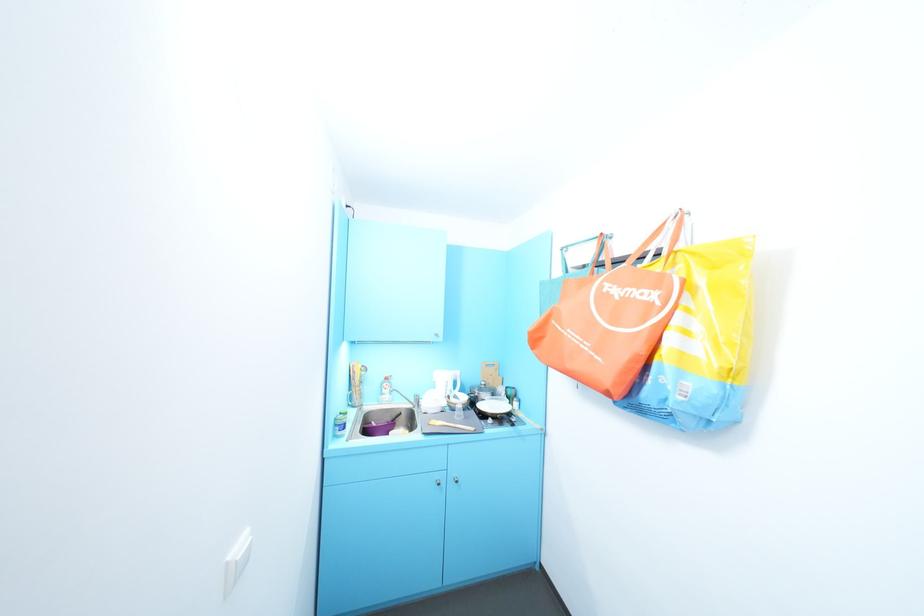
What do you see at coordinates (602, 241) in the screenshot?
I see `a orange bag handle` at bounding box center [602, 241].